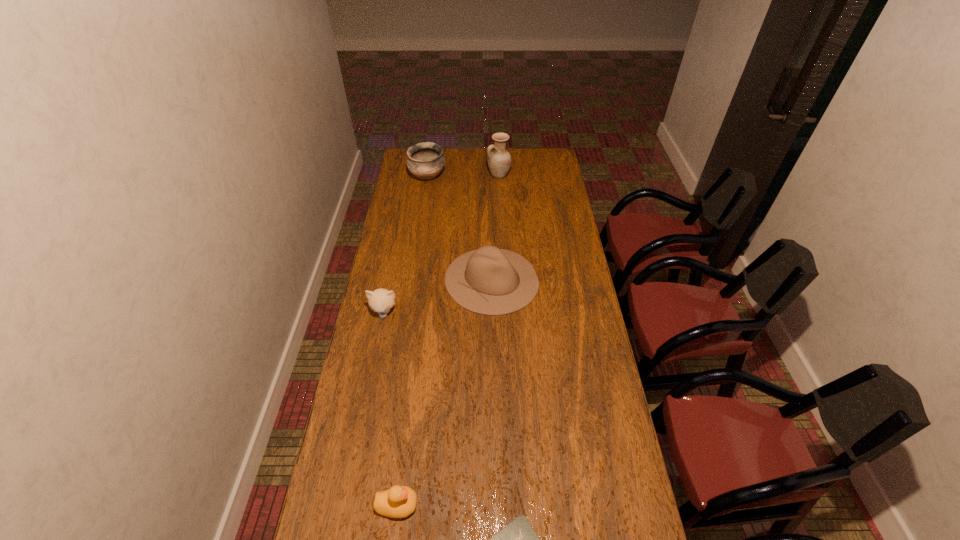
Where is `the right pottery`? The image size is (960, 540). the right pottery is located at coordinates (499, 160).

In order to click on the tallest object in this screenshot , I will do `click(499, 160)`.

You are a GUI agent. You are given a task and a screenshot of the screen. Output one action in this format:
    pyautogui.click(x=<x>, y=<y>)
    Task: Click on the left pottery
    The image size is (960, 540).
    Given the screenshot: What is the action you would take?
    pyautogui.click(x=425, y=160)

I want to click on sombrero, so click(491, 281).

Locate an element on the screen. The height and width of the screenshot is (540, 960). kitten is located at coordinates (381, 300).

I want to click on duck, so click(x=399, y=501).

Identify the location of free location located 0.130m on the back of the taller pottery. Image resolution: width=960 pixels, height=540 pixels. (498, 157).

The image size is (960, 540). Find the location of `free space located on the front of the shorter pottery`. free space located on the front of the shorter pottery is located at coordinates (x=421, y=220).

Identify the location of free spot located 0.400m on the front of the sombrero. (495, 408).

Identify the location of free space located on the face of the fourth tallest object. The image size is (960, 540). (374, 360).